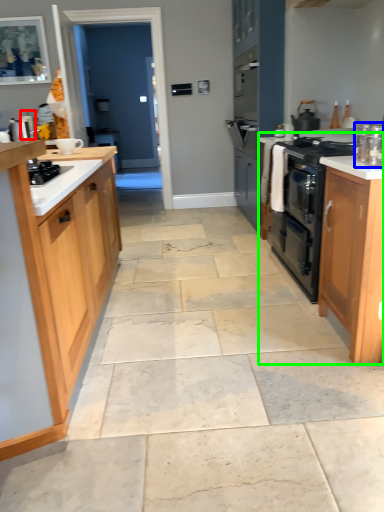
Question: Estimate the real-world distances between objects in this image. Which object is closer to appliance (highlighted by a red box), kitchen appliance (highlighted by a blue box) or counter (highlighted by a green box)?

Choices:
 (A) kitchen appliance
 (B) counter

Answer: (B)